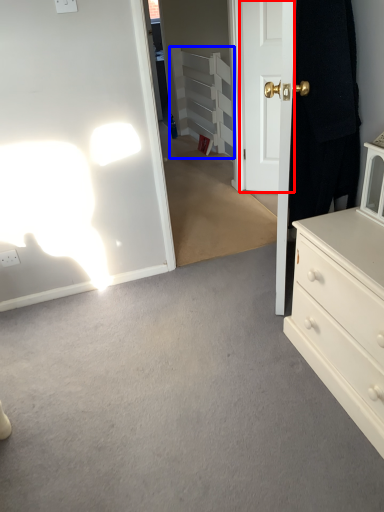
Question: Among these objects, which one is farthest to the camera, door (highlighted by a red box) or armoire (highlighted by a blue box)?

Choices:
 (A) door
 (B) armoire

Answer: (B)